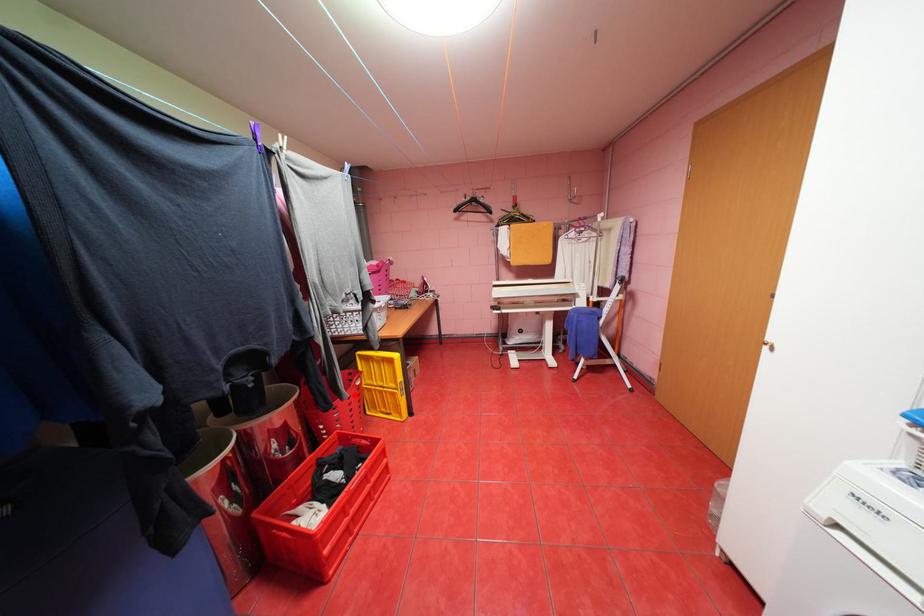
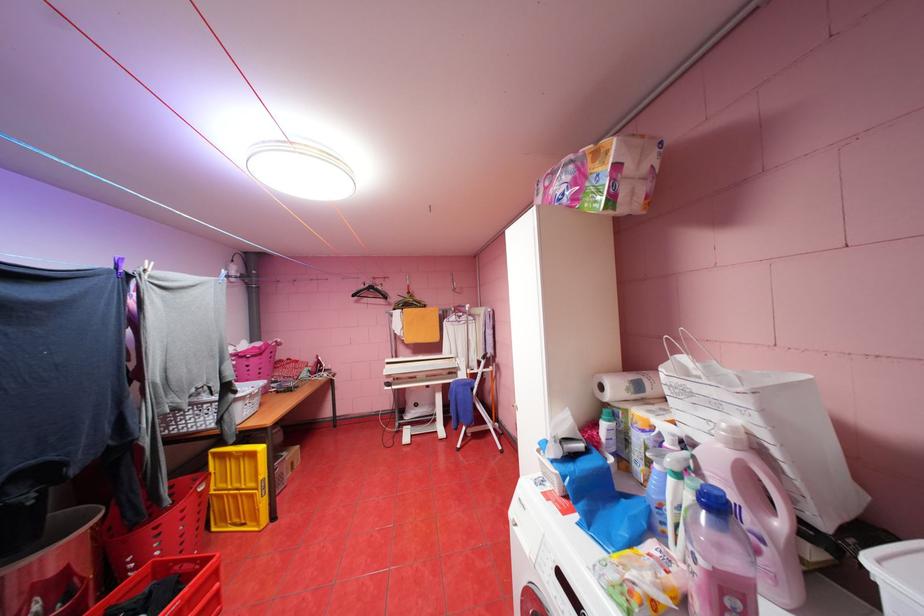
Locate, in the second image, the point that corresponds to the highlighted location in the first image.

(176, 501)